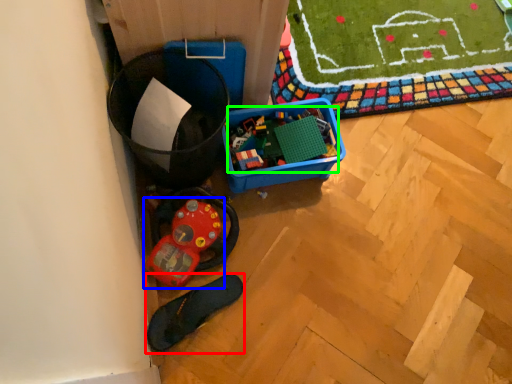
Question: Considering the real-world distances, which object is closest to footwear (highlighted by a red box)? toy (highlighted by a blue box) or toy (highlighted by a green box).

Choices:
 (A) toy
 (B) toy

Answer: (A)